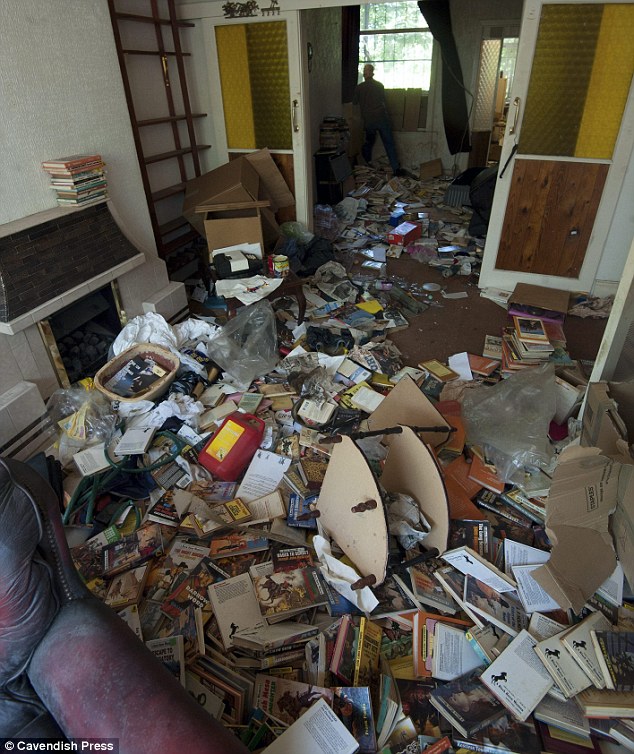
Image resolution: width=634 pixels, height=754 pixels. I want to click on arm chair, so click(x=120, y=687).